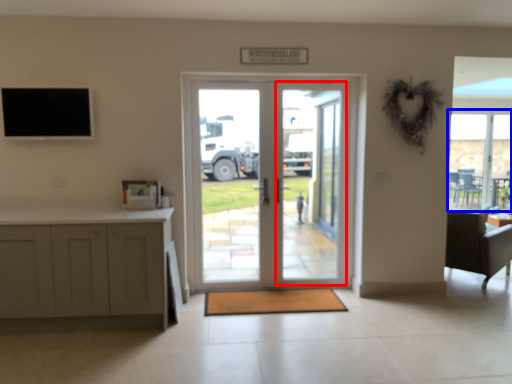
Question: Which point is closer to the camera, screen door (highlighted by a red box) or window (highlighted by a blue box)?

Choices:
 (A) screen door
 (B) window

Answer: (A)